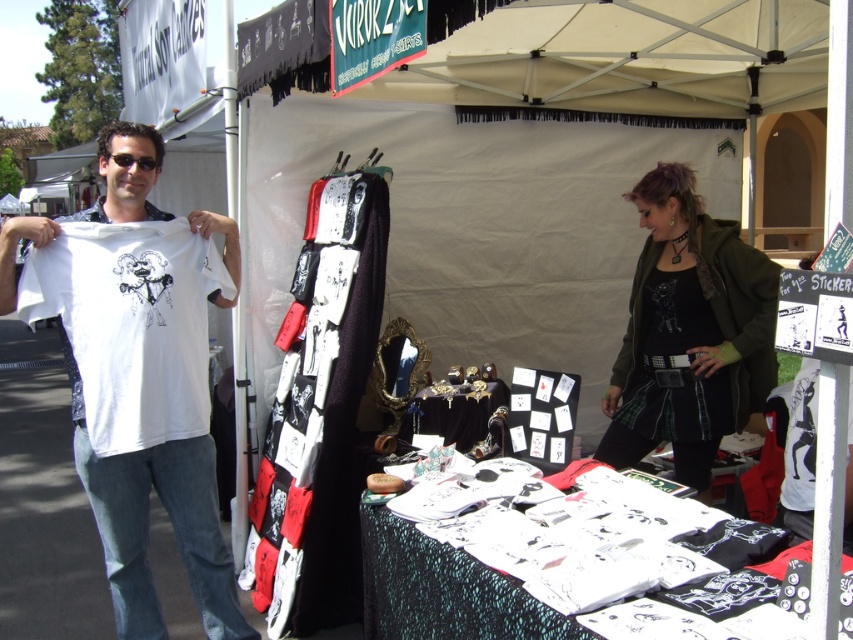
Who is shorter, white matte t-shirt at left or white paper at center?

white paper at center

Who is taller, white matte t-shirt at left or white paper at center?

white matte t-shirt at left

Is point (103, 260) farther from camera compared to point (395, 544)?

Yes, it is.

Where is `white matte t-shirt at left`? This screenshot has height=640, width=853. white matte t-shirt at left is located at coordinates (131, 324).

Looking at this image, measure the distance between matte olive green jacket at center and white paper at center.

The distance of matte olive green jacket at center from white paper at center is 5.23 feet.

Does matte olive green jacket at center appear on the right side of white paper at center?

Correct, you'll find matte olive green jacket at center to the right of white paper at center.

Is point (659, 403) positioned before point (560, 624)?

No, it is not.

Identify the location of matte olive green jacket at center. The image size is (853, 640). (689, 332).

In the scene shown: Does white matte t-shirt at left have a larger size compared to white cotton t-shirt at left?

Incorrect, white matte t-shirt at left is not larger than white cotton t-shirt at left.

Based on the photo, can you confirm if white matte t-shirt at left is smaller than white cotton t-shirt at left?

Indeed, white matte t-shirt at left has a smaller size compared to white cotton t-shirt at left.

Measure the distance between point [144,244] and camera.

They are 2.61 meters apart.

The image size is (853, 640). In order to click on white matte t-shirt at left in this screenshot , I will do `click(131, 324)`.